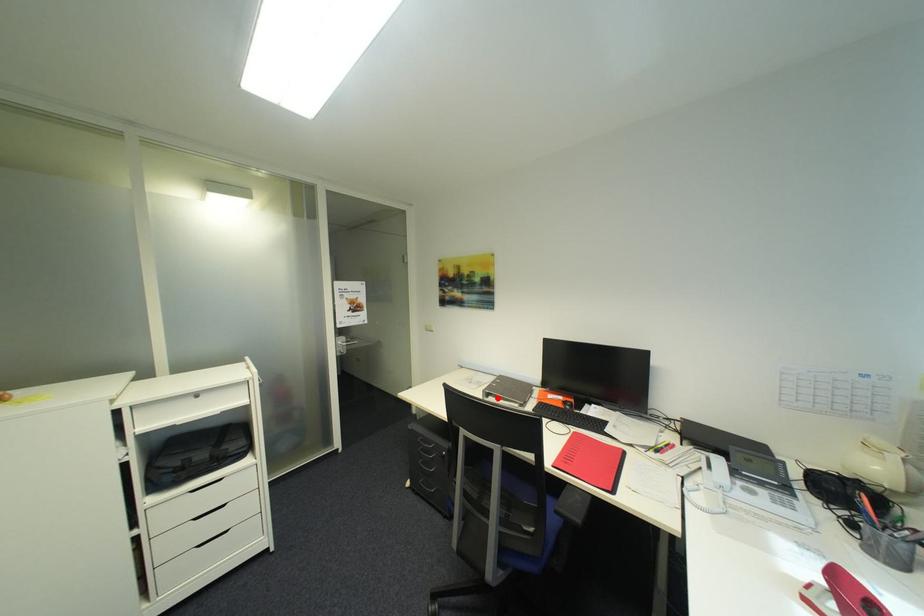
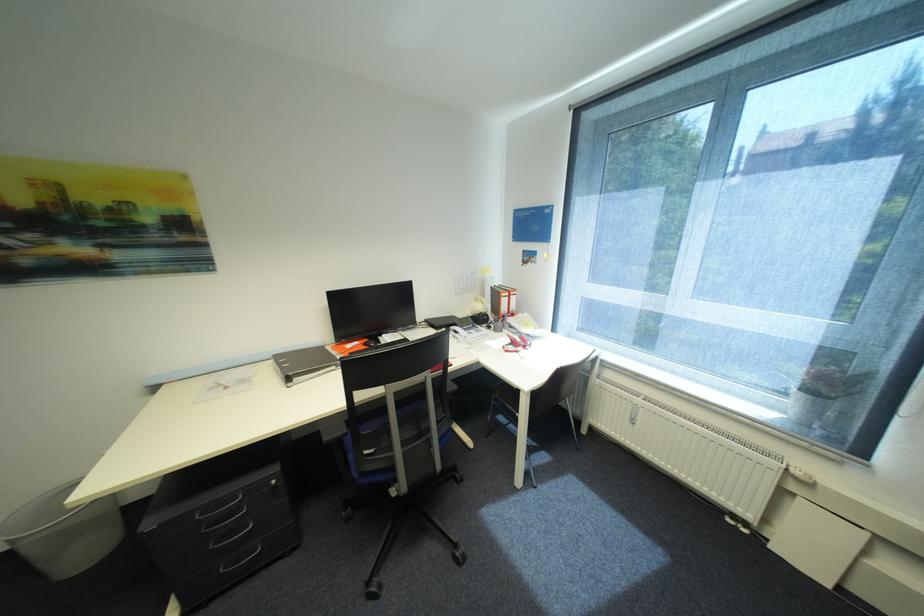
Locate, in the second image, the point that corresponds to the highlighted location in the first image.

(304, 379)